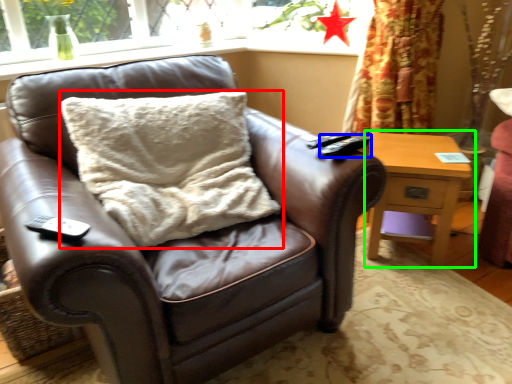
Question: Which object is positioned closest to pillow (highlighted by a red box)? Select from remote (highlighted by a blue box) and nightstand (highlighted by a green box).

Choices:
 (A) remote
 (B) nightstand

Answer: (A)